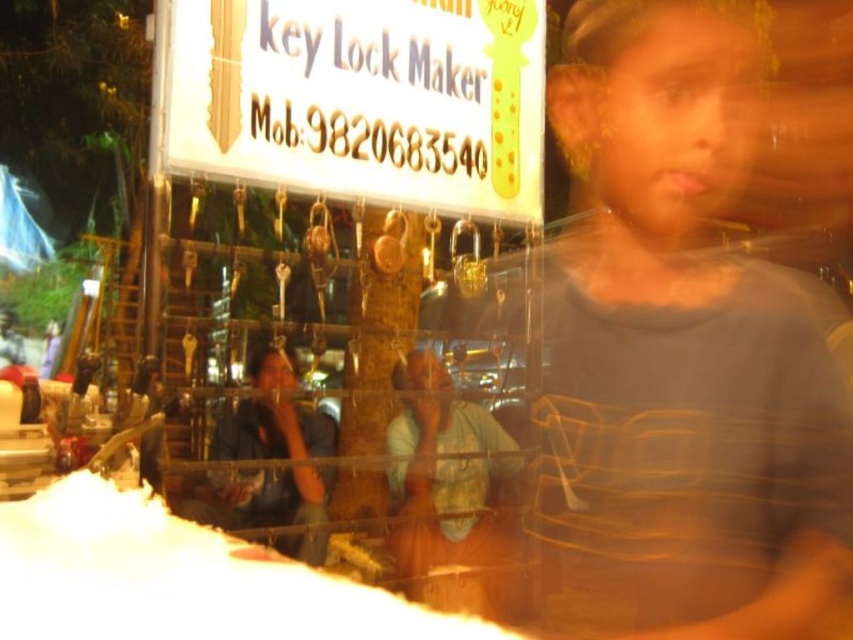
Looking at this image, you are a customer standing in front of the key Lock Maker stall. You see a blue fabric shirt at center and a black leather jacket at lower left. Which item is closer to you?

The blue fabric shirt at center is closer to you because it is further to the viewer than the black leather jacket at lower left.

You are a customer looking to purchase a new lock for your bicycle. You see a blue fabric shirt at center and a black leather jacket at lower left in the store. Which item takes up more space in the store?

The black leather jacket at lower left occupies more space than the blue fabric shirt at center.